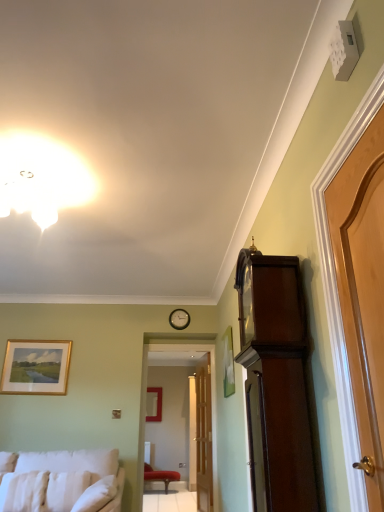
Question: In the image, is mahogany wood grandfather clock at right positioned in front of or behind light brown wooden door at right, the 2th door from the left?

Choices:
 (A) behind
 (B) front

Answer: (A)

Question: Would you say mahogany wood grandfather clock at right is inside or outside light brown wooden door at right, the 2th door from the left?

Choices:
 (A) outside
 (B) inside

Answer: (A)

Question: Based on their relative distances, which object is nearer to the white soft pillow at lower left, positioned as the 1th pillow in right-to-left order?

Choices:
 (A) transparent glass door at center
 (B) velvet red chair at center
 (C) white fluffy pillow at lower left, the second pillow from the right
 (D) white glossy light fixture at upper center
 (E) matte gold picture frame at lower left, the 2th picture frame ordered from the bottom

Answer: (C)

Question: Which of these objects is positioned farthest from the matte gold picture frame at center, which appears as the 1th picture frame when viewed from the back?

Choices:
 (A) wooden clock at center
 (B) white fabric studio couch at lower left
 (C) matte gold picture frame at lower left, the 1th picture frame viewed from the left
 (D) transparent glass door at center
 (E) white soft pillow at lower left, which is counted as the 3th pillow, starting from the right

Answer: (E)